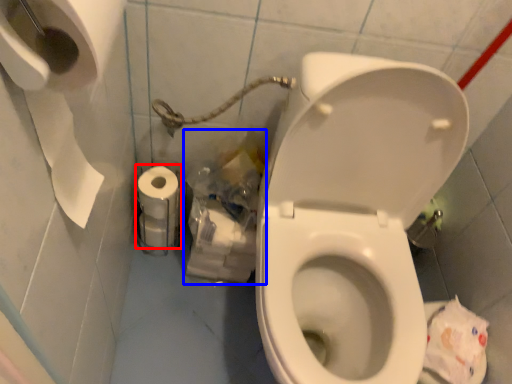
Question: Which of the following is the closest to the observer, toilet paper (highlighted by a red box) or garbage (highlighted by a blue box)?

Choices:
 (A) toilet paper
 (B) garbage

Answer: (B)